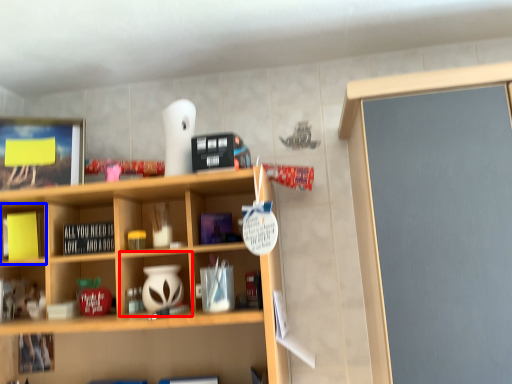
Question: Which object appears farthest to the camera in this image, cabinet (highlighted by a red box) or cabinet (highlighted by a blue box)?

Choices:
 (A) cabinet
 (B) cabinet

Answer: (B)